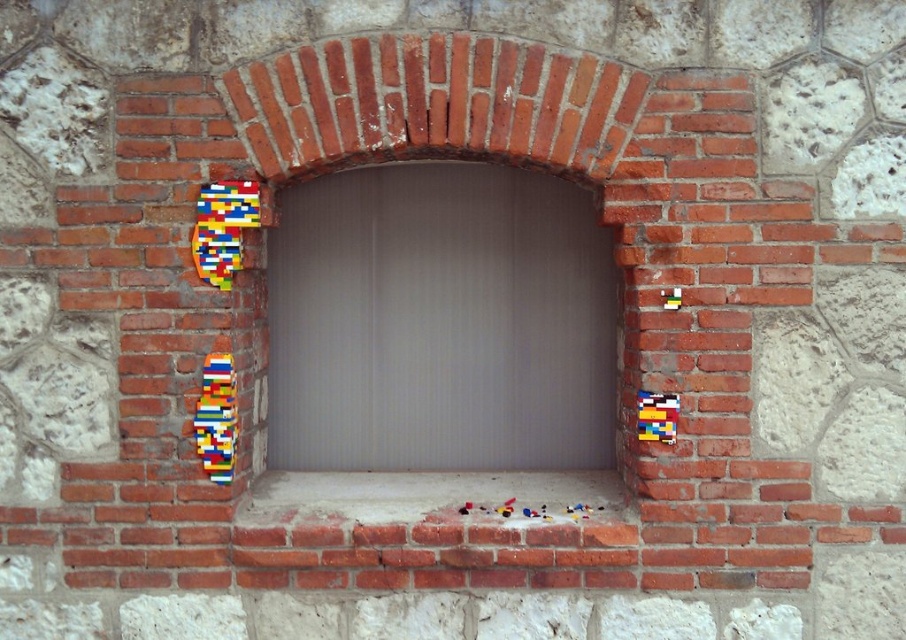
Question: Is brick at center positioned behind white concrete at center?

Choices:
 (A) yes
 (B) no

Answer: (A)

Question: Which of the following is the farthest from the observer?

Choices:
 (A) white concrete at center
 (B) brick at center

Answer: (B)

Question: Is brick at center to the right of white concrete at center from the viewer's perspective?

Choices:
 (A) no
 (B) yes

Answer: (B)

Question: Which point is farther to the camera?

Choices:
 (A) brick at center
 (B) white concrete at center

Answer: (A)

Question: Where is brick at center located in relation to white concrete at center in the image?

Choices:
 (A) above
 (B) below

Answer: (A)